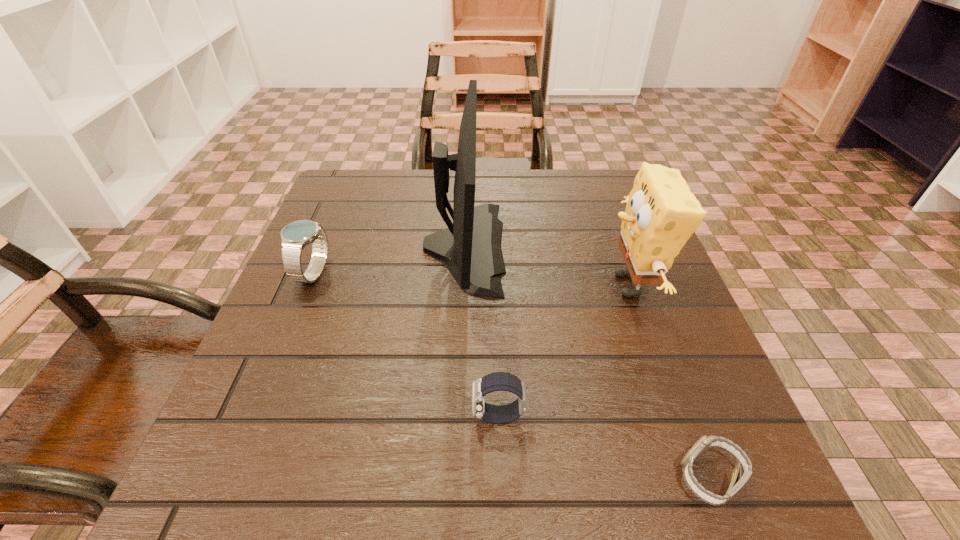
Identify the location of vacant area situated 0.090m on the face of the second tallest object. (556, 285).

Locate an element on the screen. vacant space located 0.100m on the face of the second tallest object is located at coordinates (551, 285).

This screenshot has height=540, width=960. What are the coordinates of `vacant space located 0.050m on the back of the leftmost object` in the screenshot? It's located at (328, 240).

The height and width of the screenshot is (540, 960). Identify the location of free space located 0.200m on the face of the second nearest object. (341, 416).

The height and width of the screenshot is (540, 960). Find the location of `vacant space located on the face of the second nearest object`. vacant space located on the face of the second nearest object is located at coordinates (380, 416).

Locate an element on the screen. free space located 0.070m on the face of the second nearest object is located at coordinates (426, 416).

Locate an element on the screen. free space located on the face of the shortest object is located at coordinates (525, 477).

The image size is (960, 540). I want to click on free space located on the face of the shortest object, so click(x=598, y=477).

Find the location of `free point located 0.240m on the face of the shortest object`. free point located 0.240m on the face of the shortest object is located at coordinates (503, 477).

I want to click on object that is at the far edge, so coord(470,248).